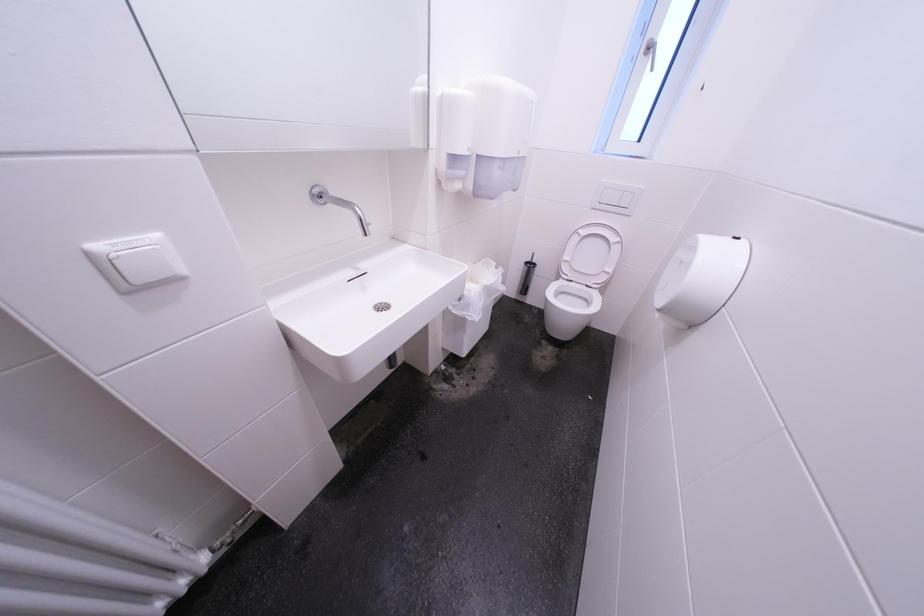
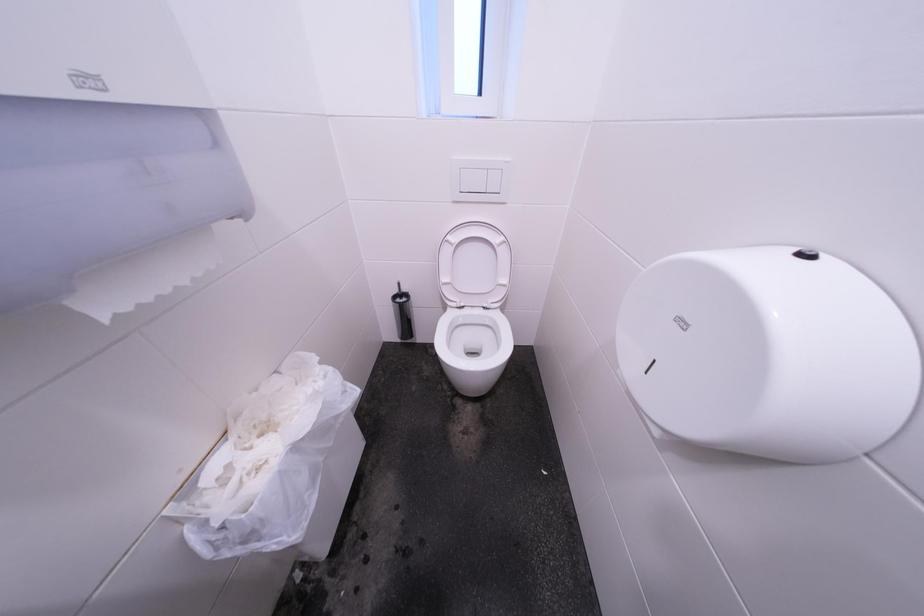
Question: The first image is from the beginning of the video and the second image is from the end. How did the camera likely rotate when shooting the video?

Choices:
 (A) Left
 (B) Right
 (C) Up
 (D) Down

Answer: (B)